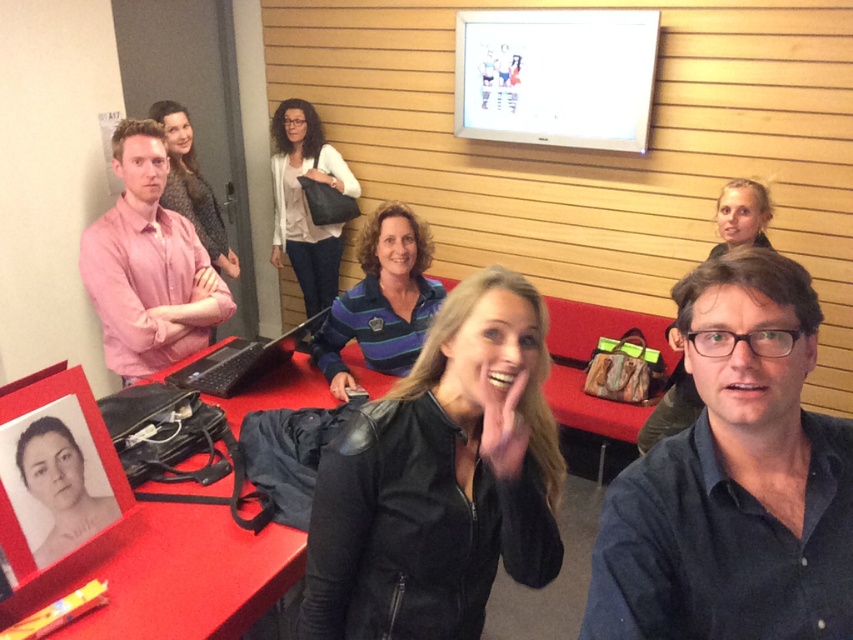
You are a photographer setting up for a group photo in this room. You need to ensure everyone is visible. Given the dark blue shirt at center and the black leather jacket at center, which person should you position closer to the front to avoid being blocked?

The dark blue shirt at center is shorter in height compared to the black leather jacket at center, so positioning the dark blue shirt at center closer to the front will help avoid being blocked by the taller individual.

You are standing in the room and want to move from the point at coordinates point (706,376) to the point at coordinates point (381,548). Which direction should you move to get closer to your destination?

To move from point (706,376) to point (381,548), you should move towards the lower right direction since point (381,548) is located to the lower right of point (706,376).

You are a photographer setting up for a group photo in the room. You want to ensure both the matte pink sweater at center and the patterned fabric dress at center are visible in the frame. Based on their positions, which one might block the other from view?

The patterned fabric dress at center is behind the matte pink sweater at center, so the matte pink sweater at center might block the patterned fabric dress at center from view.